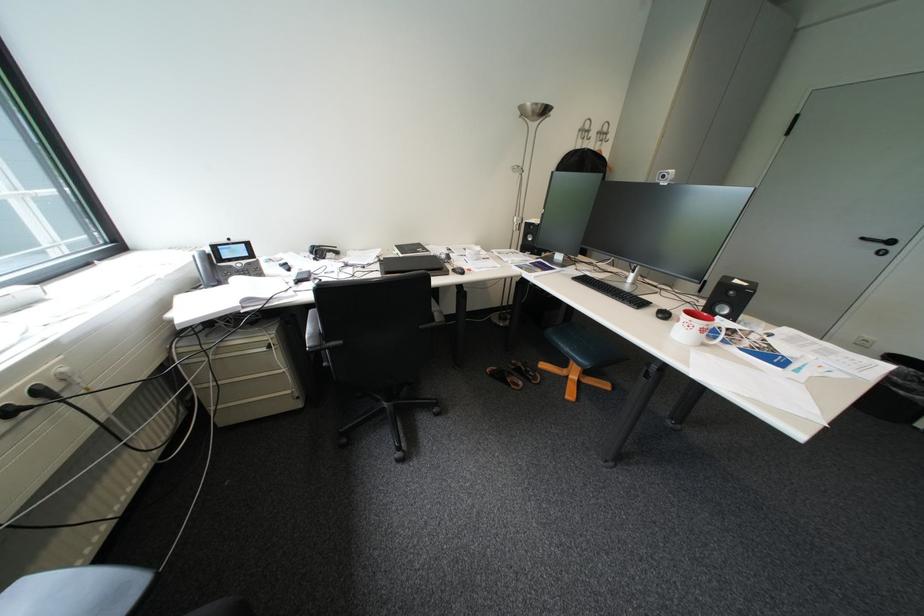
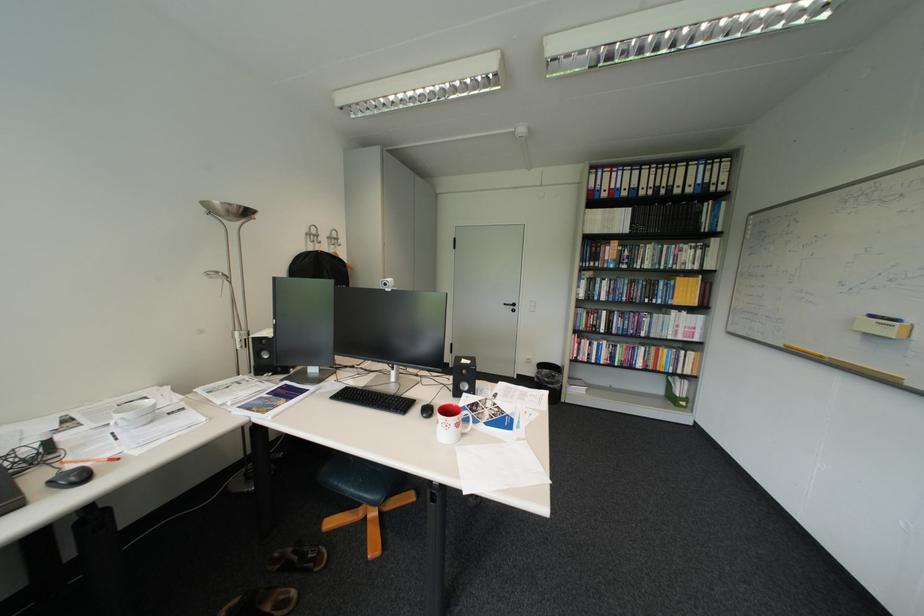
Question: Based on the continuous images, in which direction is the camera rotating? Reply with the corresponding letter.

Choices:
 (A) Left
 (B) Right
 (C) Up
 (D) Down

Answer: (B)